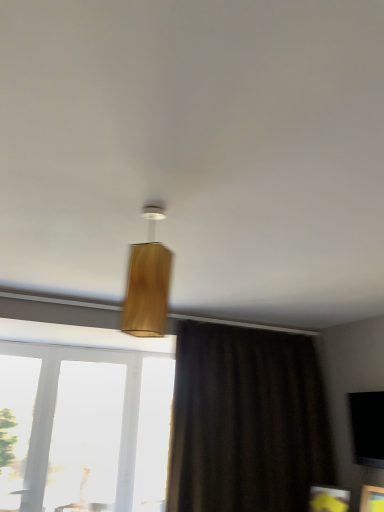
Question: Does wooden lampshade at center have a greater height compared to transparent glass window at lower left, marked as the third window in a right-to-left arrangement?

Choices:
 (A) yes
 (B) no

Answer: (B)

Question: Does wooden lampshade at center have a larger size compared to transparent glass window at lower left, the 1th window from the left?

Choices:
 (A) no
 (B) yes

Answer: (A)

Question: Is wooden lampshade at center placed right next to transparent glass window at lower left, the 1th window from the left?

Choices:
 (A) no
 (B) yes

Answer: (A)

Question: Can you confirm if wooden lampshade at center is wider than transparent glass window at lower left, the 1th window from the left?

Choices:
 (A) no
 (B) yes

Answer: (B)

Question: From the image's perspective, does wooden lampshade at center appear higher than transparent glass window at lower left, the 1th window from the left?

Choices:
 (A) yes
 (B) no

Answer: (A)

Question: Considering the relative positions of wooden lampshade at center and transparent glass window at lower left, marked as the third window in a right-to-left arrangement, in the image provided, is wooden lampshade at center to the left of transparent glass window at lower left, marked as the third window in a right-to-left arrangement, from the viewer's perspective?

Choices:
 (A) yes
 (B) no

Answer: (B)

Question: Is transparent glass window screen at lower right closer to the viewer compared to transparent glass window at lower left, marked as the third window in a right-to-left arrangement?

Choices:
 (A) no
 (B) yes

Answer: (B)

Question: Can you confirm if transparent glass window screen at lower right is wider than transparent glass window at lower left, marked as the third window in a right-to-left arrangement?

Choices:
 (A) yes
 (B) no

Answer: (A)

Question: Does transparent glass window screen at lower right touch transparent glass window at lower left, the 1th window from the left?

Choices:
 (A) yes
 (B) no

Answer: (B)

Question: From the image's perspective, is transparent glass window screen at lower right beneath transparent glass window at lower left, marked as the third window in a right-to-left arrangement?

Choices:
 (A) no
 (B) yes

Answer: (A)

Question: Does transparent glass window screen at lower right have a lesser width compared to transparent glass window at lower left, marked as the third window in a right-to-left arrangement?

Choices:
 (A) yes
 (B) no

Answer: (B)

Question: Does transparent glass window screen at lower right have a larger size compared to transparent glass window at lower left, marked as the third window in a right-to-left arrangement?

Choices:
 (A) yes
 (B) no

Answer: (B)

Question: From a real-world perspective, is transparent glass window at lower left, which is the second window in right-to-left order, physically below wooden lampshade at center?

Choices:
 (A) yes
 (B) no

Answer: (A)